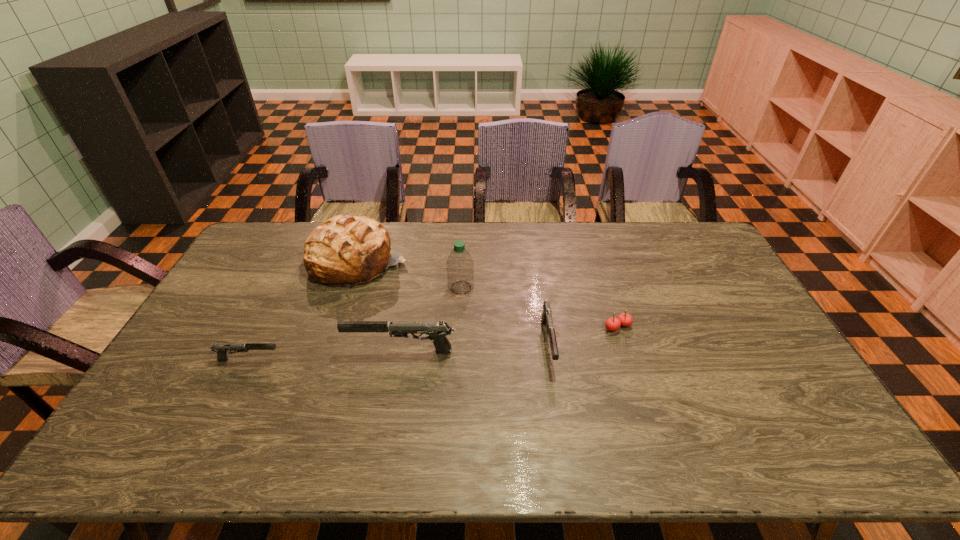
Image resolution: width=960 pixels, height=540 pixels. Find the location of `vacant space situated 0.250m at the muzzle end of the second gun from left to right`. vacant space situated 0.250m at the muzzle end of the second gun from left to right is located at coordinates (258, 352).

The image size is (960, 540). I want to click on free location located at the muzzle end of the second gun from left to right, so click(x=213, y=352).

Identify the location of free space located 0.120m at the muzzle end of the second tallest gun. The image size is (960, 540). (559, 414).

Find the location of a particular element. The image size is (960, 540). vacant area situated 0.330m on the right of the bread is located at coordinates (500, 262).

This screenshot has width=960, height=540. What are the coordinates of `free space located 0.240m on the left of the water bottle` in the screenshot? It's located at (375, 288).

The image size is (960, 540). Identify the location of vacant space situated on the left of the rightmost object. (520, 327).

Where is `object that is at the far edge`? The height and width of the screenshot is (540, 960). object that is at the far edge is located at coordinates (344, 251).

Find the location of a particular element. The width and height of the screenshot is (960, 540). object that is at the left edge is located at coordinates (222, 349).

Where is `free space at the far edge of the desktop`? This screenshot has height=540, width=960. free space at the far edge of the desktop is located at coordinates pyautogui.click(x=507, y=230).

Locate an element on the screen. The image size is (960, 540). free space at the near edge of the desktop is located at coordinates (707, 412).